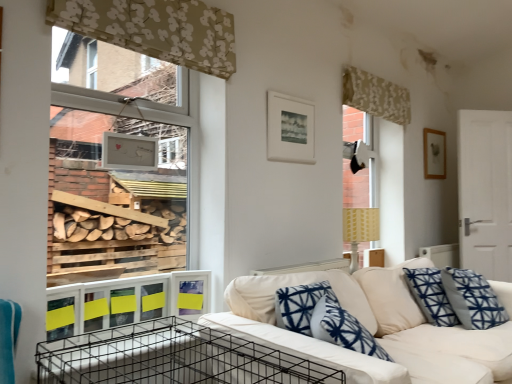
Locate an element on the screen. spots to the right of yellow paper at lower left is located at coordinates (160, 336).